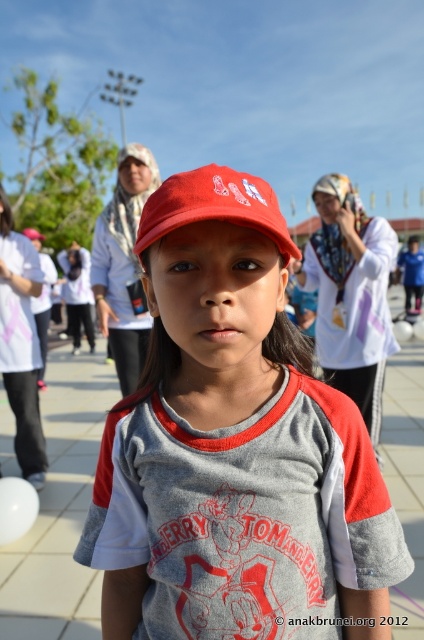
Is matte red cap at center smaller than matte red baseball cap at center?

Actually, matte red cap at center might be larger than matte red baseball cap at center.

Does point (257, 442) come in front of point (198, 168)?

No, it is behind (198, 168).

Where is `matte red cap at center`? This screenshot has height=640, width=424. matte red cap at center is located at coordinates (234, 448).